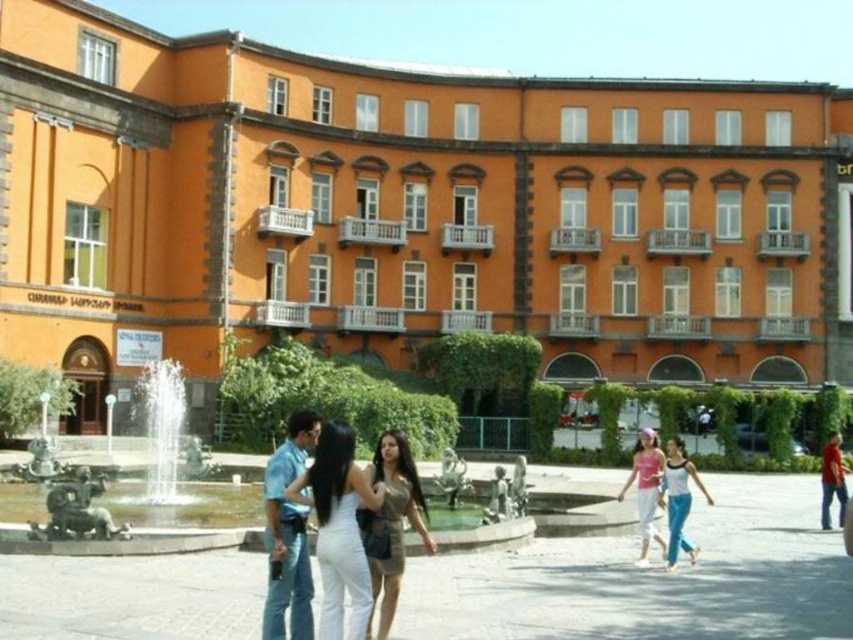
Question: Considering the real-world distances, which object is farthest from the white cotton dress at center?

Choices:
 (A) shiny metallic fountain at center
 (B) brown leather dress at center
 (C) orange matte building at upper center
 (D) pink fabric dress at center

Answer: (C)

Question: Which point is closer to the camera?

Choices:
 (A) (393, 451)
 (B) (663, 544)

Answer: (A)

Question: Does orange matte building at upper center appear over white cotton tank top at center?

Choices:
 (A) no
 (B) yes

Answer: (B)

Question: Can you confirm if brown leather dress at center is wider than white cotton tank top at center?

Choices:
 (A) no
 (B) yes

Answer: (A)

Question: Which point is farther to the camera?

Choices:
 (A) white cotton tank top at center
 (B) pink fabric dress at center
 (C) shiny metallic fountain at center

Answer: (B)

Question: Can you confirm if white cotton dress at center is smaller than shiny metallic fountain at center?

Choices:
 (A) no
 (B) yes

Answer: (B)